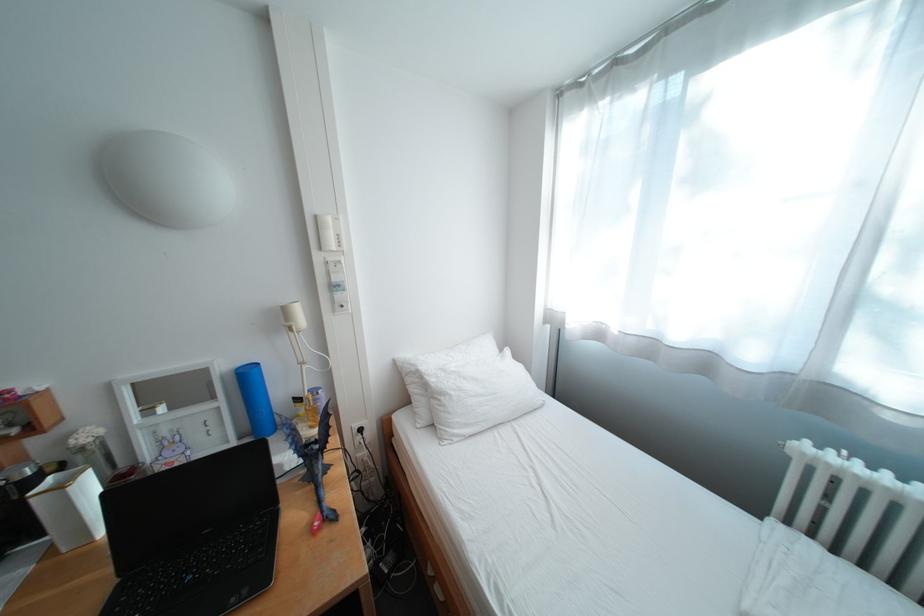
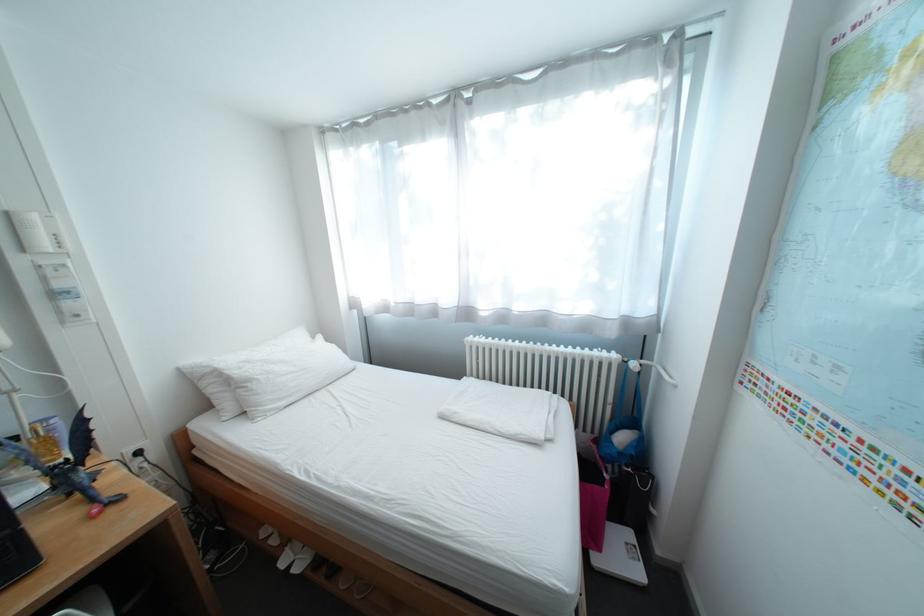
Locate, in the second image, the point that corresponds to pixel 314 403 in the first image.

(31, 440)